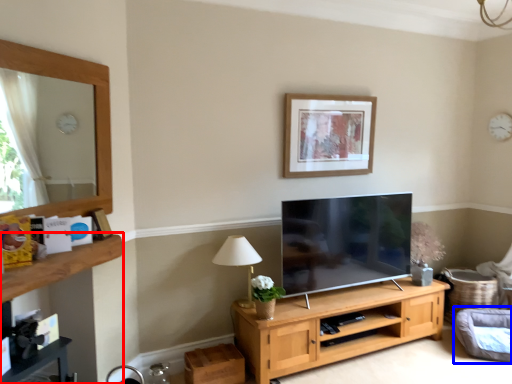
Question: Among these objects, which one is nearest to the camera, dresser (highlighted by a red box) or swivel chair (highlighted by a blue box)?

Choices:
 (A) dresser
 (B) swivel chair

Answer: (A)